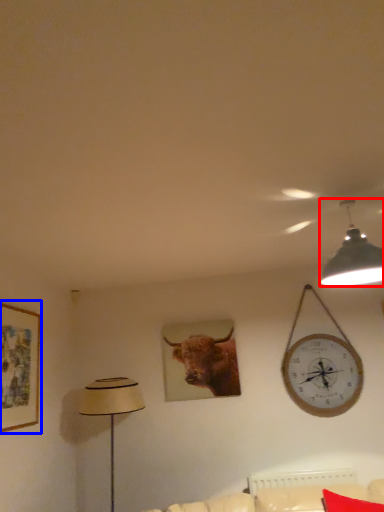
Question: Which object is further to the camera taking this photo, lamp (highlighted by a red box) or picture frame (highlighted by a blue box)?

Choices:
 (A) lamp
 (B) picture frame

Answer: (B)